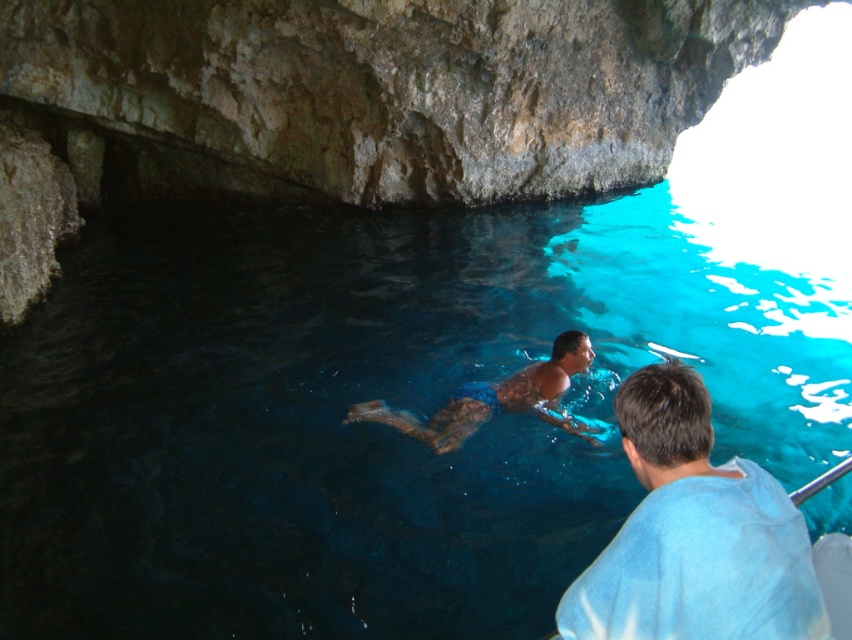
You are a diver navigating an underwater cave. You see the clear blue water at center. Based on its position, can you estimate where it is located in the cave?

The clear blue water at center is located at the coordinates point (366, 422), so it is positioned towards the right side of the cave.

You are a scuba diver preparing to take a photo of the point at coordinates (770, 520) in an underwater cave. Your camera has a maximum focus range of 2 meters. Will the point be in focus?

The point at coordinates (770, 520) is 1.89 meters away from the camera, which is within the maximum focus range of 2 meters. Therefore, the point will be in focus.

You are a diver navigating an underwater cave. You see two points marked in your map. The first point is at coordinates point (774, 563) and the second is at point (400, 426). Which point is closer to you as you swim towards the right side of the cave?

Point (774, 563) is in front of point (400, 426), so the first point is closer to you as you swim towards the right side of the cave.